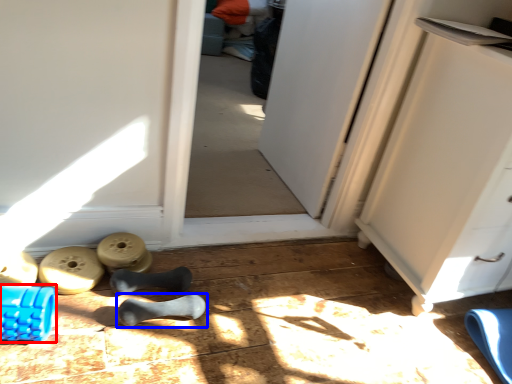
Question: Which of the following is the closest to the observer, job (highlighted by a red box) or footwear (highlighted by a blue box)?

Choices:
 (A) job
 (B) footwear

Answer: (A)